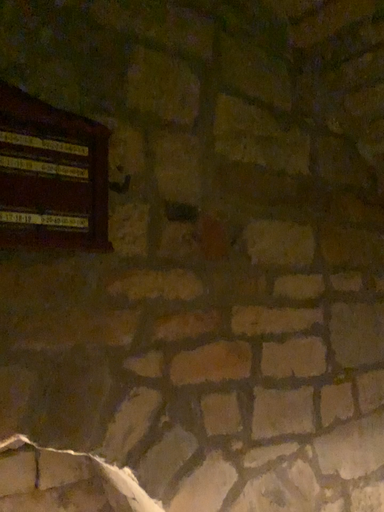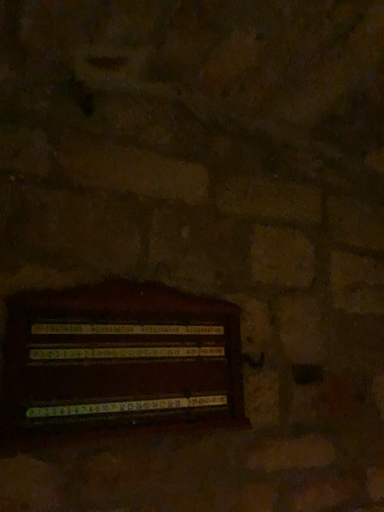
Question: Which way did the camera rotate in the video?

Choices:
 (A) rotated left
 (B) rotated right

Answer: (A)